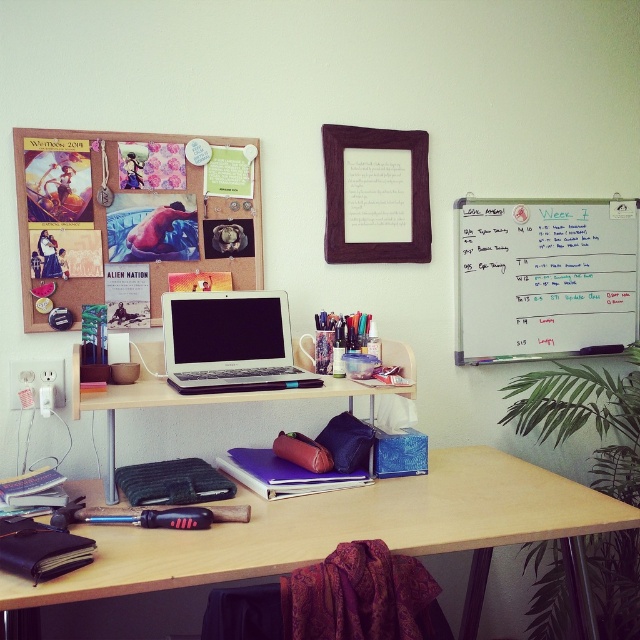
Consider the image. You are setting up a new workspace and want to place a small decorative item between the purple fabric picture frame at upper center and the matte black laptop at center. Considering their sizes, which object should the item be placed closer to?

The purple fabric picture frame at upper center has a smaller size compared to the matte black laptop at center, so the small decorative item should be placed closer to the purple fabric picture frame at upper center to maintain balance.

You are setting up a presentation and need to connect an external monitor. The sleek silver laptop at center and the matte black laptop at center are both on your desk. Which one is physically on top of the other?

The sleek silver laptop at center is positioned over the matte black laptop at center, so it is physically on top.

You are setting up a presentation and need to connect an external monitor. You have two laptops on your desk, the sleek silver laptop at center and the matte black laptop at center. Which one is positioned closer to the back of the desk to plug in the cable?

The matte black laptop at center is positioned behind the sleek silver laptop at center, so it is closer to the back of the desk. You should plug the cable into the matte black laptop at center.